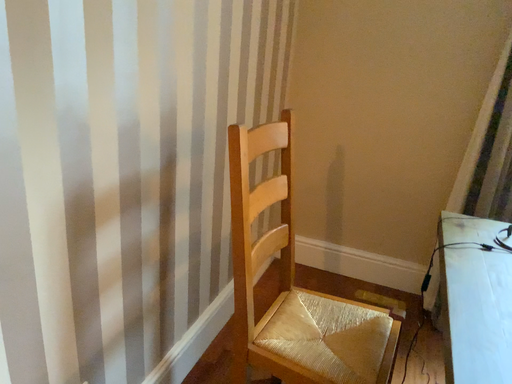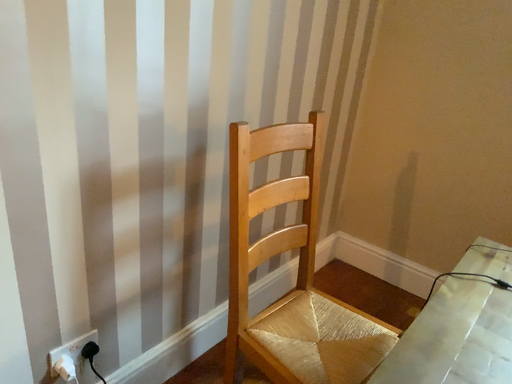
Question: Which way did the camera rotate in the video?

Choices:
 (A) rotated right
 (B) rotated left

Answer: (B)